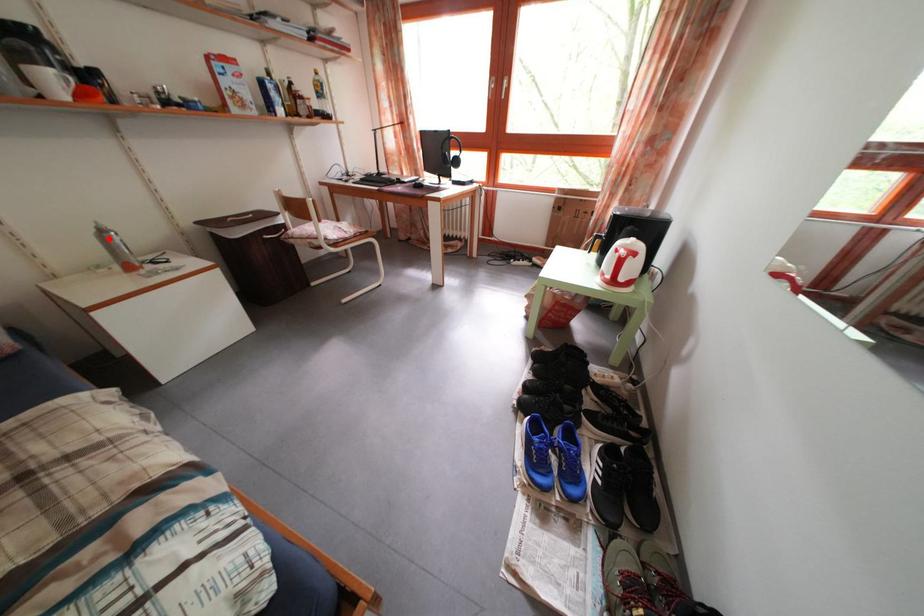
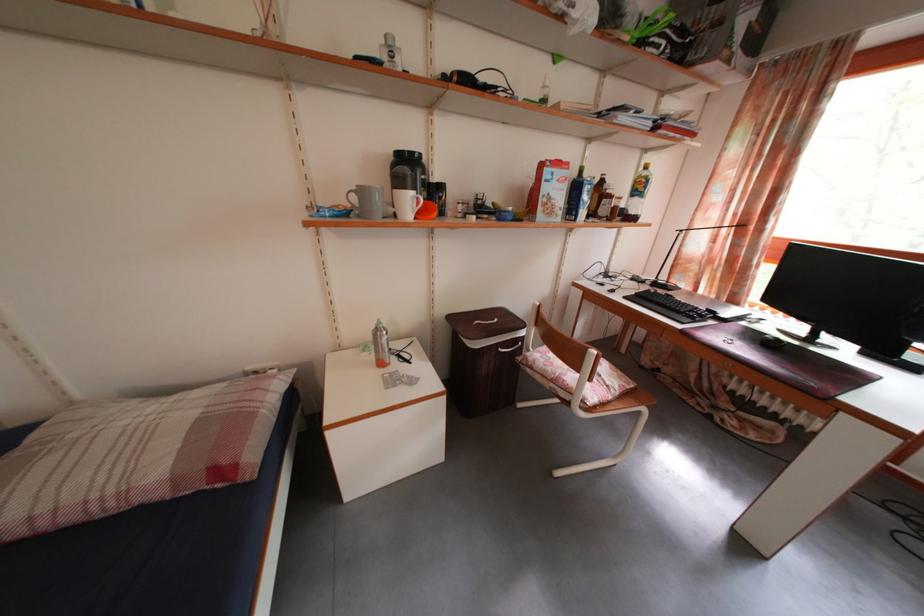
In the second image, find the point that corresponds to the highlighted location in the first image.

(384, 338)